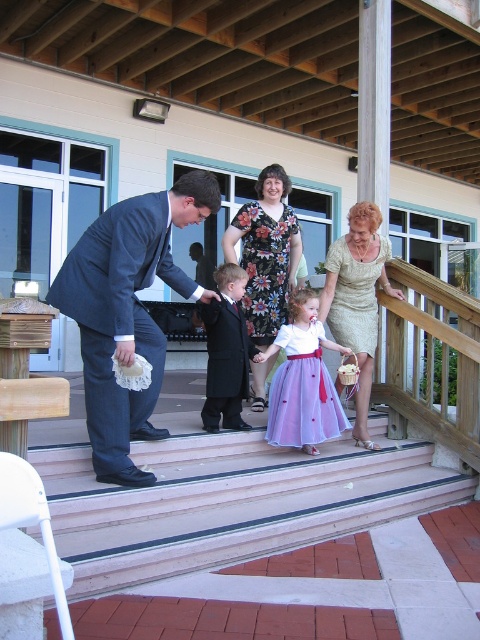
You are standing on the wooden porch and want to go down the smooth concrete stairs at center. According to the coordinates provided, in which direction should you move relative to your current position to reach the stairs?

The smooth concrete stairs at center are located at coordinates point (229, 500). Since the stairs are at the center of the porch, you should move towards the center area where the stairs are positioned to reach them.

You are a photographer setting up for an event. You see the lavender satin dress at center and the gold textured dress at center. Which dress should you focus on if you want to capture the larger one?

The gold textured dress at center is larger than the lavender satin dress at center, so you should focus on the gold textured dress at center.